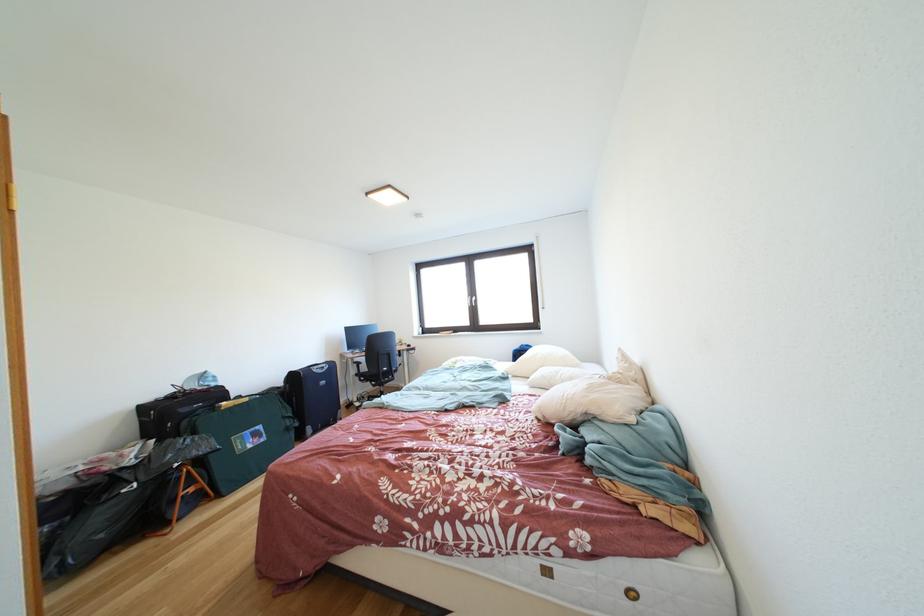
Where is `chair armrest`? The height and width of the screenshot is (616, 924). chair armrest is located at coordinates (379, 360).